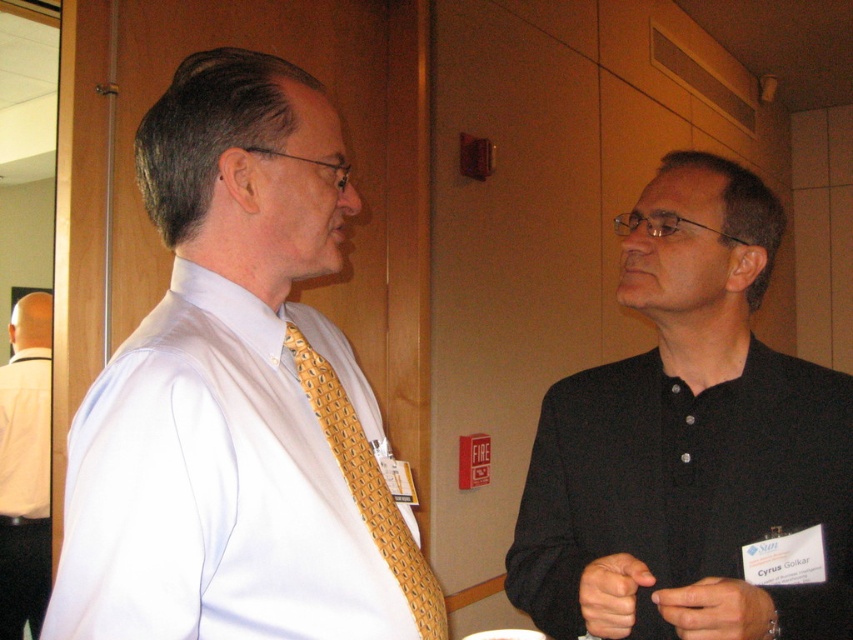
Measure the distance between point (544, 548) and camera.

They are 1.12 meters apart.

Does black matte shirt at right have a smaller size compared to yellowgeometric patterned fabrictie at left?

Actually, black matte shirt at right might be larger than yellowgeometric patterned fabrictie at left.

Between point (784, 528) and point (405, 561), which one is positioned in front?

Positioned in front is point (405, 561).

Where is `black matte shirt at right`? The image size is (853, 640). black matte shirt at right is located at coordinates (688, 442).

Based on the photo, can you confirm if white smooth dress shirt at left is bigger than yellowgeometric patterned fabrictie at left?

Yes, white smooth dress shirt at left is bigger than yellowgeometric patterned fabrictie at left.

Based on the photo, who is taller, white smooth dress shirt at left or yellowgeometric patterned fabrictie at left?

white smooth dress shirt at left

Is point (148, 586) behind point (325, 417)?

No, (148, 586) is in front of (325, 417).

Identify the location of white smooth dress shirt at left. (238, 397).

Is point (91, 461) in front of point (750, 465)?

Yes.

Measure the distance between white smooth dress shirt at left and camera.

The distance of white smooth dress shirt at left from camera is 26.06 inches.

Locate an element on the screen. This screenshot has height=640, width=853. white smooth dress shirt at left is located at coordinates (238, 397).